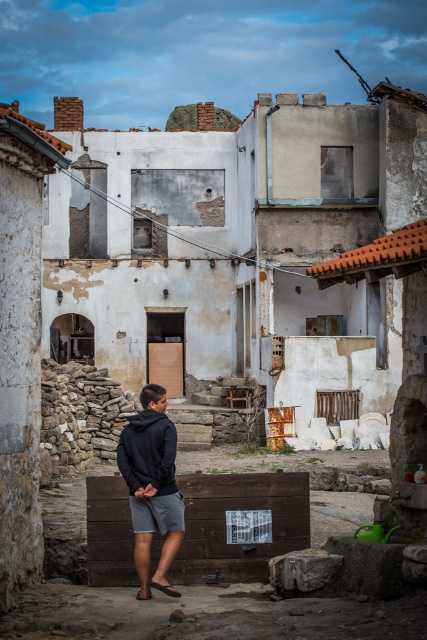
You are a delivery person trying to locate a package left at the center of the scene. The package is placed between the dark gray hoodie at center and the black rubber sandal at lower center. Since the hoodie is to the left of the sandal, which direction should you look from the sandal to find the package?

The dark gray hoodie at center is to the left of the black rubber sandal at lower center, so the package is located to the left of the sandal. Therefore, you should look to the left from the sandal to find the package.

You are a delivery person with a 1.5 meter wide cart. You need to navigate through the path between the black fleece sweatshirt at center and the wooden barrier. Can your cart fit through the path?

The path between the black fleece sweatshirt at center and the wooden barrier is 15.99 meters wide, so yes, the cart can fit through the path since it is much wider than the cart.

You are a delivery person trying to locate a package left at the center of the image. According to the map, the package is at point (148, 452). What object is located at that point?

The point (148, 452) marks the black fleece sweatshirt at center, so the package is at the black fleece sweatshirt at center.